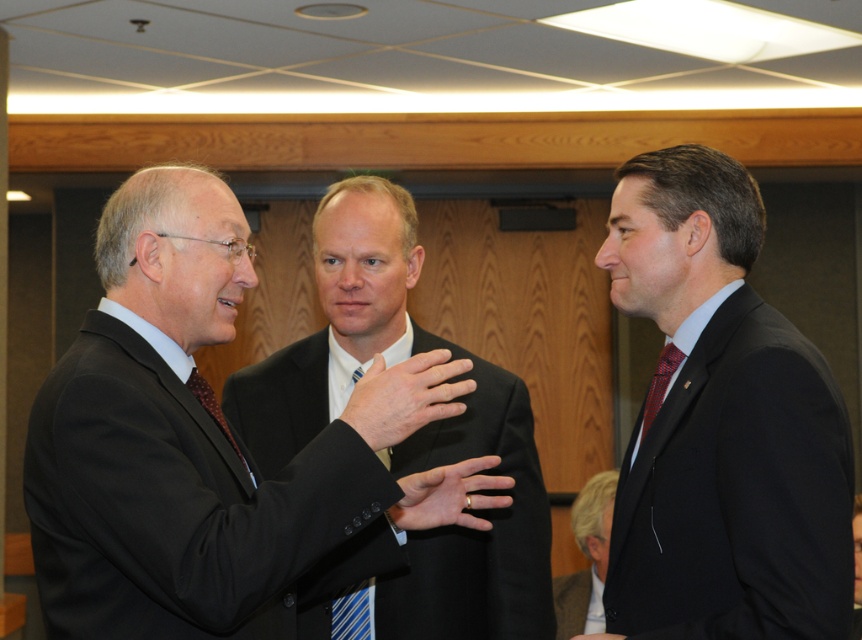
Question: Which point appears closest to the camera in this image?

Choices:
 (A) (397, 522)
 (B) (603, 636)
 (C) (717, 276)
 (D) (420, 353)

Answer: (D)

Question: Does matte black suit at center have a smaller size compared to light brown leather jacket at lower right?

Choices:
 (A) yes
 (B) no

Answer: (B)

Question: Does matte black suit at center have a larger size compared to matte black hand at center?

Choices:
 (A) no
 (B) yes

Answer: (B)

Question: Can you confirm if black wool suit at center is bigger than gold metallic ring at center?

Choices:
 (A) yes
 (B) no

Answer: (A)

Question: Which of these objects is positioned closest to the matte black suit at center?

Choices:
 (A) polka dot silk tie at center
 (B) red plaid tie at right
 (C) matte black hand at center

Answer: (A)

Question: Which point is farther to the camera?

Choices:
 (A) smooth black suit at center
 (B) polka dot silk tie at center

Answer: (B)